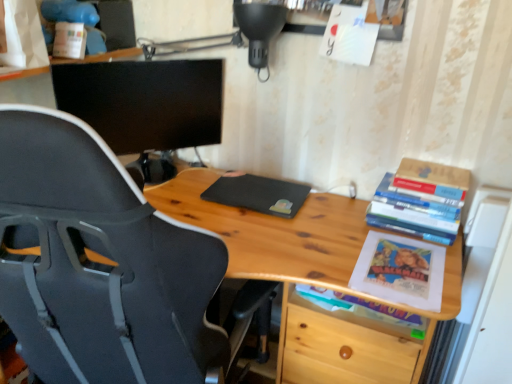
The height and width of the screenshot is (384, 512). Identify the location of free space in front of black matte laptop at center. pyautogui.click(x=268, y=233).